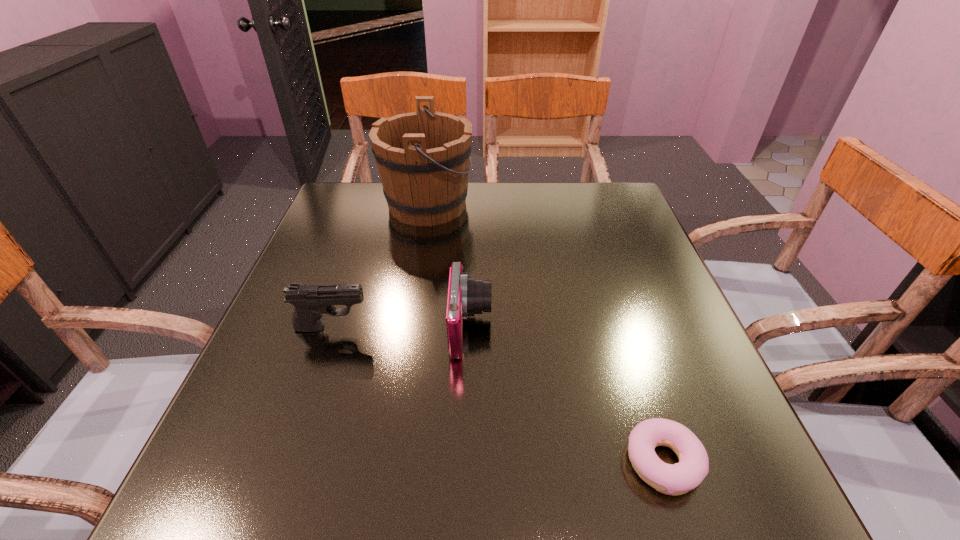
The height and width of the screenshot is (540, 960). I want to click on vacant space at the right edge, so point(644,250).

The width and height of the screenshot is (960, 540). I want to click on free region at the far right corner of the desktop, so click(597, 187).

Identify the location of vacant area between the shortest object and the camera. (566, 395).

Locate an element on the screen. This screenshot has height=540, width=960. free area in between the wine bucket and the pistol is located at coordinates (380, 266).

You are a GUI agent. You are given a task and a screenshot of the screen. Output one action in this format:
    pyautogui.click(x=<x>, y=<y>)
    Task: Click on the blank region between the farthest object and the pistol
    This screenshot has height=540, width=960.
    Given the screenshot: What is the action you would take?
    pyautogui.click(x=380, y=266)

This screenshot has width=960, height=540. What are the coordinates of `free spot between the pistol and the camera` in the screenshot? It's located at (401, 328).

The image size is (960, 540). In order to click on free space between the pistol and the camera in this screenshot , I will do `click(401, 328)`.

The image size is (960, 540). Find the location of `unoccupied position between the shortest object and the camera`. unoccupied position between the shortest object and the camera is located at coordinates (566, 395).

You are a GUI agent. You are given a task and a screenshot of the screen. Output one action in this format:
    pyautogui.click(x=<x>, y=<y>)
    Task: Click on the vacant area that lies between the pistol and the farthest object
    
    Given the screenshot: What is the action you would take?
    pyautogui.click(x=380, y=266)

Where is `free point between the pistol and the camera`? free point between the pistol and the camera is located at coordinates (401, 328).